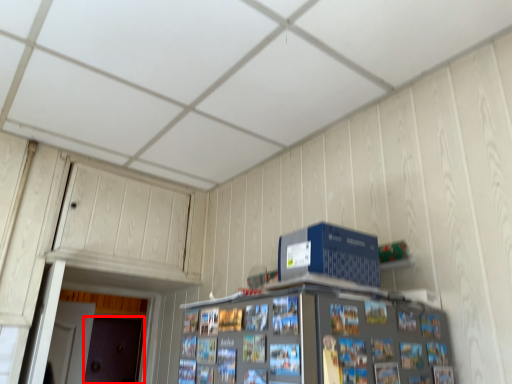
Question: From the image's perspective, where is door (annotated by the red box) located in relation to computer in the image?

Choices:
 (A) below
 (B) above

Answer: (A)